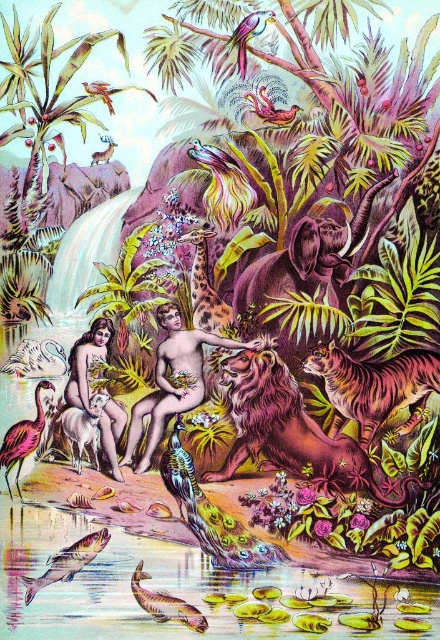
You are standing at the point labeled as point (x=415, y=417) in the tropical paradise scene. If you want to take a photo of the entire scene with a camera that has a 50mm lens, which has a field of view of approximately 46 degrees, will the entire scene fit in your photo?

The point labeled as point 0.653, 0.944 and the camera are 3.19 meters apart from each other. To determine if the entire scene fits in the photo, we need to calculate the field of view. With a 50mm lens and a 46 degree field of view, the maximum distance covered at 3.19 meters would be approximately 4.8 meters wide. Since the scene is within this width, the entire scene would fit in the photo.

From the picture: You are standing in the tropical paradise scene and want to move from the point at coordinate (81,392) to the point at coordinate (19,452). Which direction should you move to get closer to your destination?

You should move downward and to the right because the destination point at (19,452) is located lower and further to the right compared to the starting point at (81,392).

You are standing in the tropical paradise scene and want to walk from point A to point B. Point A is located at coordinate point (x=399, y=403) and point B is at coordinate point (x=87, y=381). Since you can only move forward, will you need to walk towards or away from the viewer to reach point B from point A?

Point A is further to the viewer than point B, so to reach point B from point A, you need to walk away from the viewer.